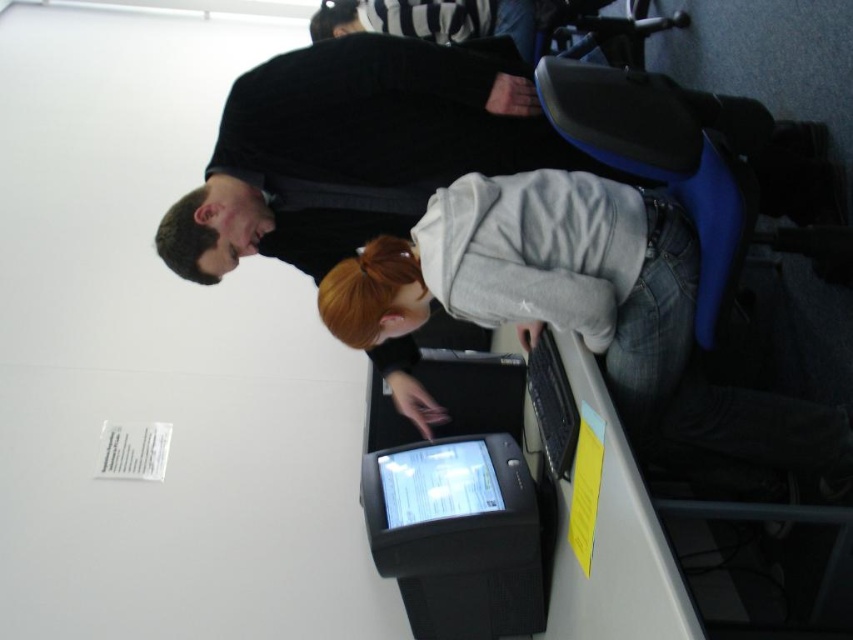
You are trying to place a new accessory on the desk between the gray fleece hoodie at center and the black glossy tablet at center. Which object should you move to make space, and why?

The gray fleece hoodie at center is wider than the black glossy tablet at center. Therefore, moving the gray fleece hoodie at center would create more space for the new accessory.